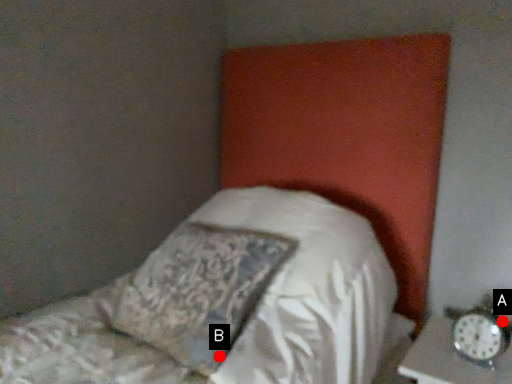
Question: Two points are circled on the image, labeled by A and B beside each circle. Among these points, which one is nearest to the camera?

Choices:
 (A) A is closer
 (B) B is closer

Answer: (B)